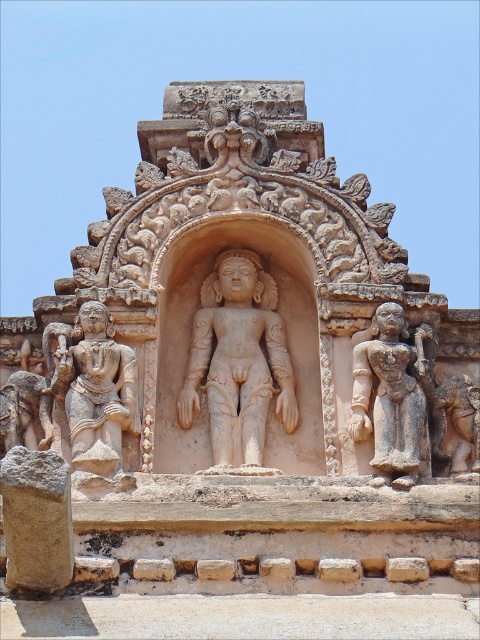
Is point (222, 364) closer to camera compared to point (379, 376)?

That is False.

Can you confirm if beige stone statue at center is bigger than gray stone statue at right?

Yes.

You are a GUI agent. You are given a task and a screenshot of the screen. Output one action in this format:
    pyautogui.click(x=<x>, y=<y>)
    Task: Click on the beige stone statue at center
    The image size is (480, 640).
    Given the screenshot: What is the action you would take?
    pyautogui.click(x=238, y=360)

Locate an element on the screen. The width and height of the screenshot is (480, 640). beige stone statue at center is located at coordinates (238, 360).

Can you confirm if stone statue at left is shorter than gray stone statue at right?

Correct, stone statue at left is not as tall as gray stone statue at right.

Does stone statue at left have a greater height compared to gray stone statue at right?

Incorrect, stone statue at left's height is not larger of gray stone statue at right's.

Which is in front, point (92, 378) or point (425, 388)?

Point (92, 378) is in front.

Where is `stone statue at left`? The height and width of the screenshot is (640, 480). stone statue at left is located at coordinates (93, 387).

Does beige stone statue at center appear on the right side of stone statue at left?

Correct, you'll find beige stone statue at center to the right of stone statue at left.

I want to click on beige stone statue at center, so click(238, 360).